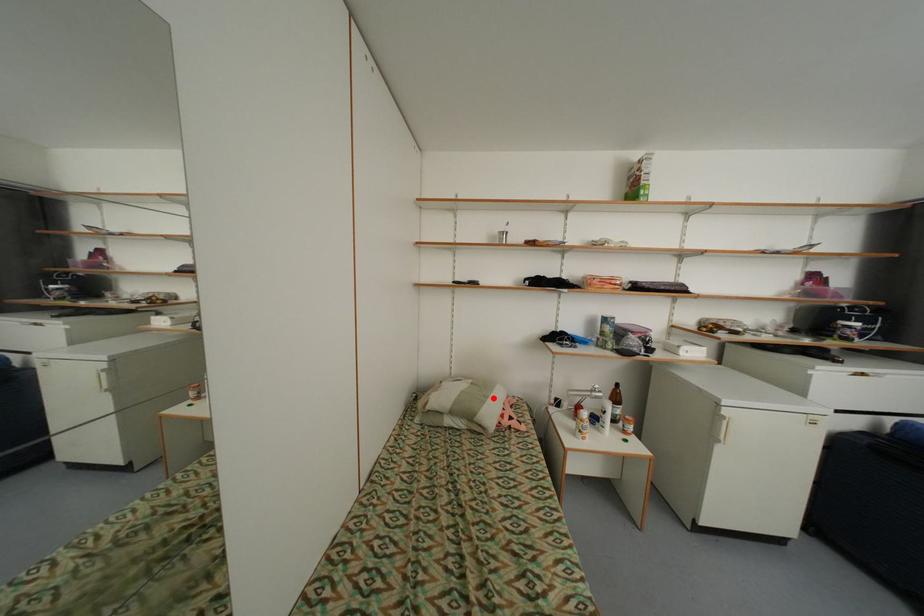
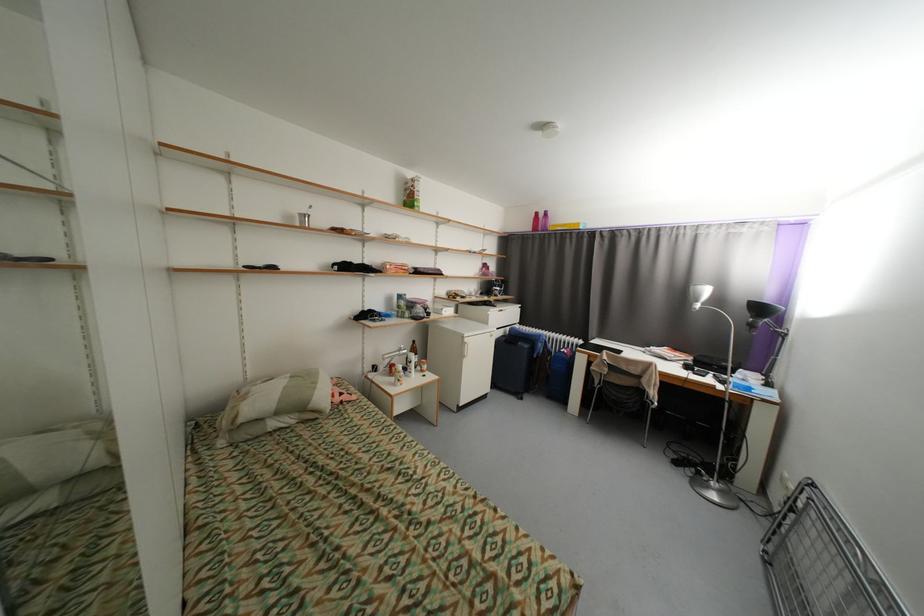
Where in the second image is the point corresponding to the highlighted location from the first image?

(322, 384)